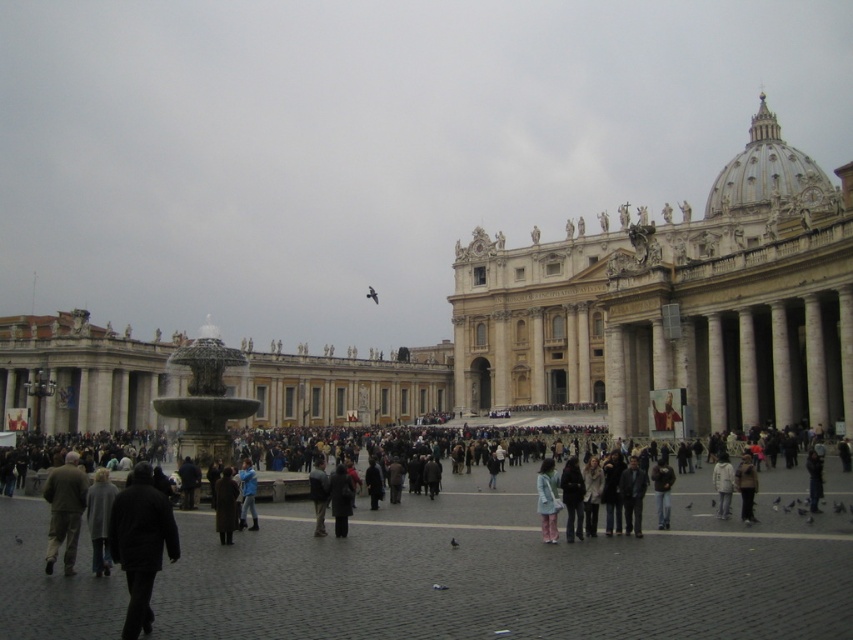
Does dark gray fabric jacket at lower left appear under dark gray fabric jacket at center?

No.

Is point (97, 481) less distant than point (320, 509)?

Yes.

Is point (100, 500) more distant than point (321, 529)?

No, it is not.

What are the coordinates of `dark gray fabric jacket at lower left` in the screenshot? It's located at (99, 518).

Is dark gray jacket at center positioned in front of brown leather coat at center?

Yes, dark gray jacket at center is closer to the viewer.

Who is positioned more to the right, dark gray jacket at center or brown leather coat at center?

dark gray jacket at center

Between point (633, 508) and point (231, 474), which one is positioned behind?

Point (231, 474)

This screenshot has width=853, height=640. In order to click on dark gray jacket at center in this screenshot , I will do `click(631, 496)`.

Is dark gray fabric jacket at lower left to the right of blue denim jeans at center from the viewer's perspective?

No, dark gray fabric jacket at lower left is not to the right of blue denim jeans at center.

How much distance is there between dark gray fabric jacket at lower left and blue denim jeans at center?

10.27 meters

Where is `dark gray fabric jacket at lower left`? This screenshot has height=640, width=853. dark gray fabric jacket at lower left is located at coordinates (x=99, y=518).

Find the location of `dark gray fabric jacket at lower left`. dark gray fabric jacket at lower left is located at coordinates (99, 518).